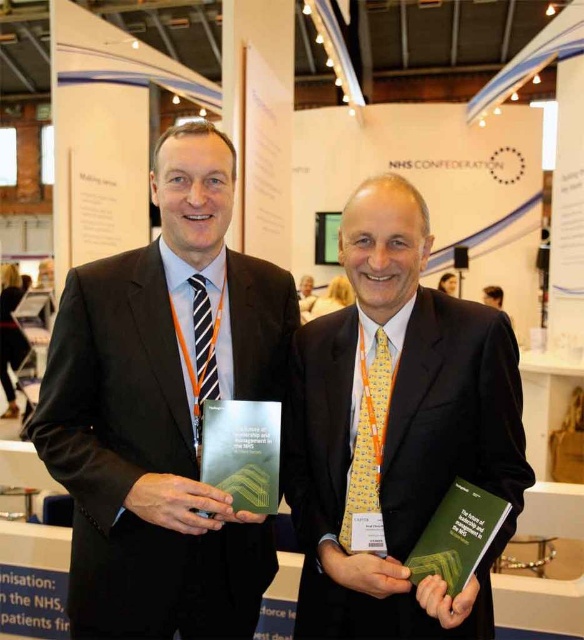
Question: Can you confirm if dark brown suit at center is smaller than yellow textured tie at center?

Choices:
 (A) no
 (B) yes

Answer: (A)

Question: Is dark brown suit at center bigger than yellow textured tie at center?

Choices:
 (A) no
 (B) yes

Answer: (B)

Question: Which of the following is the farthest from the observer?

Choices:
 (A) dark brown suit at center
 (B) yellow textured tie at center

Answer: (A)

Question: Which point is closer to the camera?

Choices:
 (A) dark brown suit at center
 (B) yellow textured tie at center

Answer: (B)

Question: Does dark brown suit at center have a larger size compared to yellow textured tie at center?

Choices:
 (A) no
 (B) yes

Answer: (B)

Question: Among these points, which one is nearest to the camera?

Choices:
 (A) (489, 564)
 (B) (203, 144)

Answer: (A)